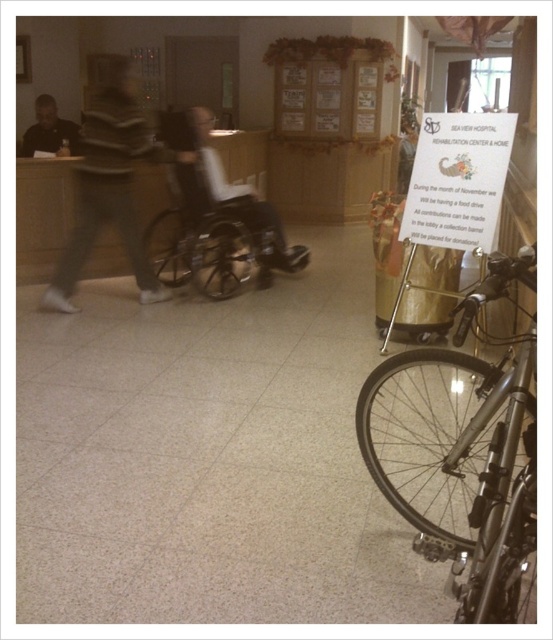
Is black plastic wheelchair at center to the left of matte black shirt at upper left from the viewer's perspective?

Incorrect, black plastic wheelchair at center is not on the left side of matte black shirt at upper left.

Image resolution: width=553 pixels, height=640 pixels. What do you see at coordinates (221, 186) in the screenshot?
I see `black plastic wheelchair at center` at bounding box center [221, 186].

Is point (231, 186) farther from viewer compared to point (25, 152)?

That is False.

Find the location of `black plastic wheelchair at center`. black plastic wheelchair at center is located at coordinates (221, 186).

Is matte black wheelchair at center bigger than black plastic wheelchair at center?

Incorrect, matte black wheelchair at center is not larger than black plastic wheelchair at center.

Is point (253, 248) closer to viewer compared to point (228, 196)?

No.

Does point (204, 266) lie behind point (232, 189)?

No, (204, 266) is in front of (232, 189).

I want to click on matte black wheelchair at center, so click(211, 232).

Is gray striped sweater at center bigger than matte black shirt at upper left?

Yes.

Consider the image. Can you confirm if gray striped sweater at center is positioned below matte black shirt at upper left?

Yes.

What do you see at coordinates (109, 184) in the screenshot? I see `gray striped sweater at center` at bounding box center [109, 184].

The image size is (553, 640). What are the coordinates of `gray striped sweater at center` in the screenshot? It's located at (109, 184).